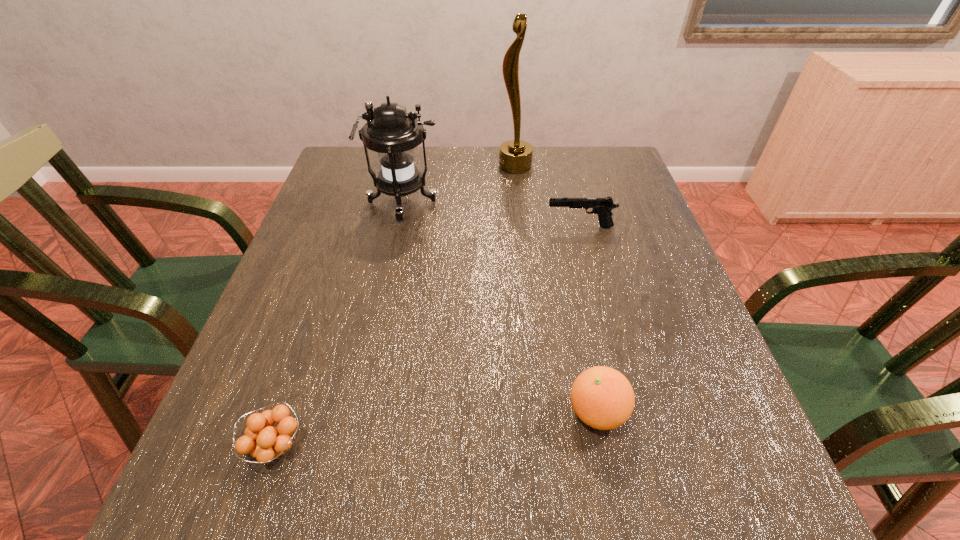
You are a GUI agent. You are given a task and a screenshot of the screen. Output one action in this format:
    pyautogui.click(x=<x>, y=<y>)
    Task: Click on the farthest object
    The image size is (960, 540).
    Given the screenshot: What is the action you would take?
    pyautogui.click(x=515, y=156)

Where is `award`? award is located at coordinates (515, 156).

The image size is (960, 540). Identify the location of lantern. (390, 131).

The width and height of the screenshot is (960, 540). I want to click on the right orange fruit, so click(602, 397).

Where is `gun`? The width and height of the screenshot is (960, 540). gun is located at coordinates (602, 206).

The height and width of the screenshot is (540, 960). In order to click on the shortest object in this screenshot , I will do `click(265, 444)`.

Identify the location of the shorter orange fruit. Image resolution: width=960 pixels, height=540 pixels. (265, 444).

Find the location of `vacant space located on the front-facing side of the farthest object`. vacant space located on the front-facing side of the farthest object is located at coordinates (424, 166).

You are a GUI agent. You are given a task and a screenshot of the screen. Output one action in this format:
    pyautogui.click(x=<x>, y=<y>)
    Task: Click on the vacant area situated on the front-facing side of the farthest object
    
    Given the screenshot: What is the action you would take?
    pyautogui.click(x=428, y=166)

Identify the location of vacant space situated 0.290m on the front-facing side of the farthest object. This screenshot has height=540, width=960. (401, 166).